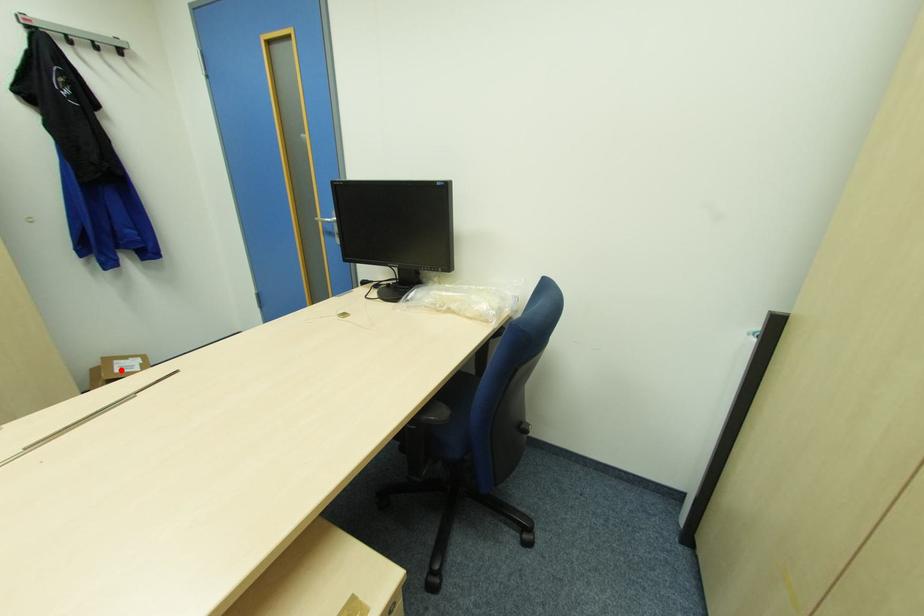
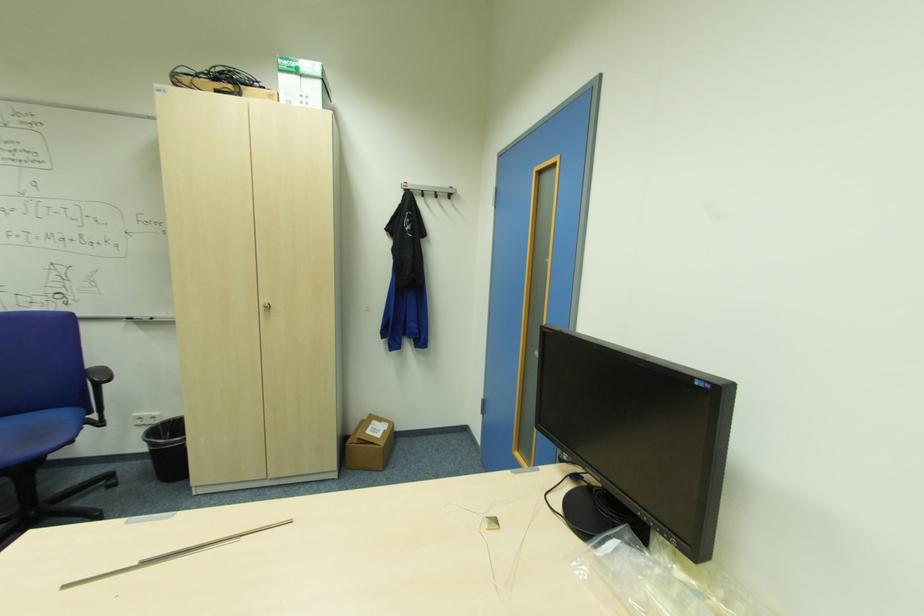
Question: I am providing you with two images of the same scene from different viewpoints. A red point is shown in image1. For the corresponding object point in image2, is it positioned nearer or farther from the camera?

Choices:
 (A) Nearer
 (B) Farther

Answer: (B)